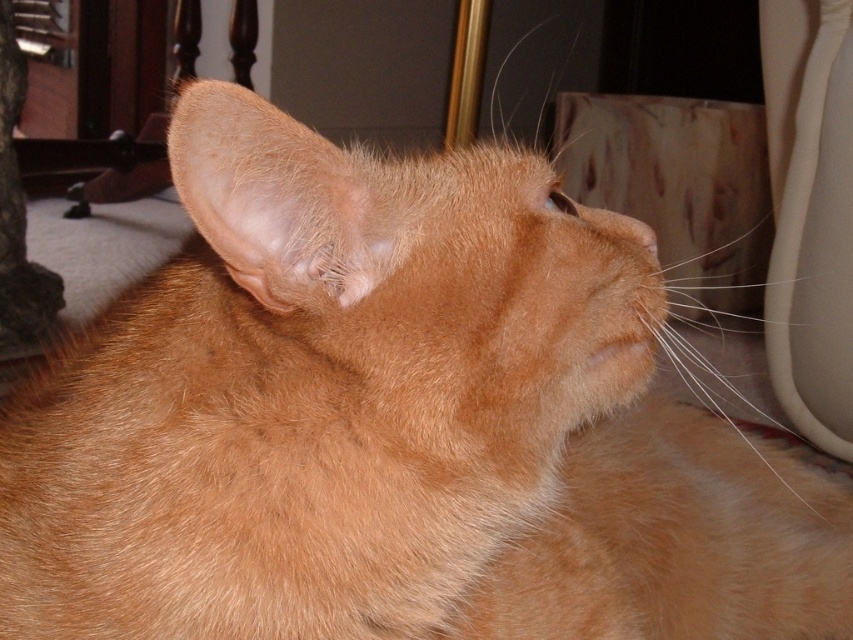
Does point (566, 432) lie in front of point (212, 225)?

No, it is not.

Consider the image. Is orange fur at center bigger than orange fur at upper left?

Yes.

You are a GUI agent. You are given a task and a screenshot of the screen. Output one action in this format:
    pyautogui.click(x=<x>, y=<y>)
    Task: Click on the orange fur at center
    
    Given the screenshot: What is the action you would take?
    coord(421,269)

This screenshot has width=853, height=640. Identify the location of orange fur at center. (421, 269).

What do you see at coordinates (283, 200) in the screenshot? I see `orange fur at upper left` at bounding box center [283, 200].

What do you see at coordinates (283, 200) in the screenshot? I see `orange fur at upper left` at bounding box center [283, 200].

Where is `orange fur at upper left`? orange fur at upper left is located at coordinates (283, 200).

Does point (366, 314) come in front of point (581, 209)?

That is True.

Does point (624, 269) come behind point (596, 216)?

That is False.

Locate an element on the screen. orange fur at center is located at coordinates (421, 269).